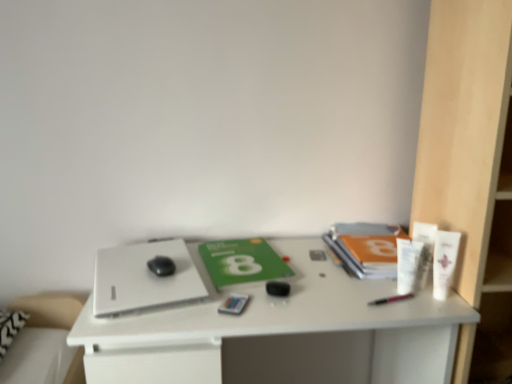
Locate an element on the screen. vacant space that's between matte plastic card at center, which appears as the first stationery when viewed from the left, and white plastic tube at right, the second toiletry in the left-to-right sequence is located at coordinates click(319, 297).